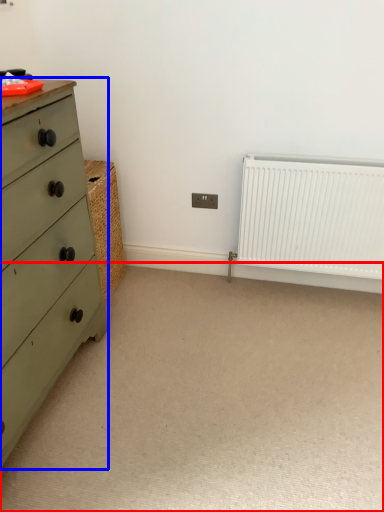
Question: Which object is closer to the camera taking this photo, plain (highlighted by a red box) or chest of drawers (highlighted by a blue box)?

Choices:
 (A) plain
 (B) chest of drawers

Answer: (B)